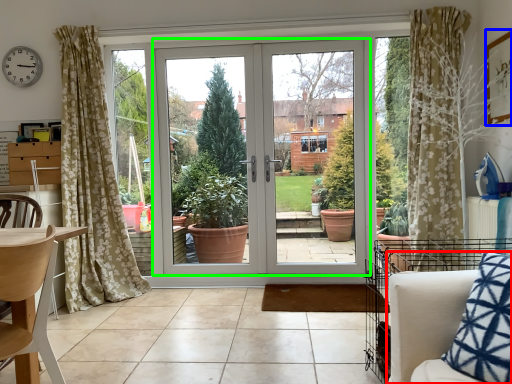
Question: Estimate the real-world distances between objects in this image. Which object is farther from armchair (highlighted by a red box), picture frame (highlighted by a blue box) or door (highlighted by a green box)?

Choices:
 (A) picture frame
 (B) door

Answer: (B)